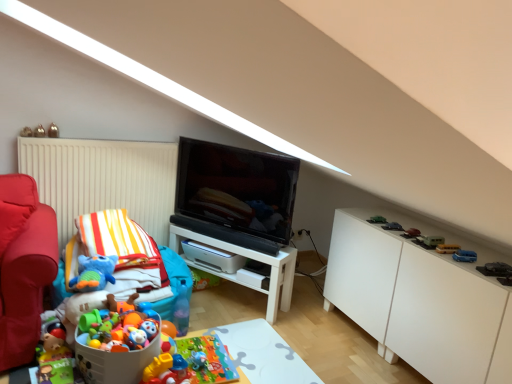
Question: Is metallic silver toy at upper left, placed as the 12th toy when sorted from bottom to top, not inside metallic gold toy at upper left, which is counted as the 1th toy, starting from the left?

Choices:
 (A) yes
 (B) no

Answer: (A)

Question: Is the depth of metallic silver toy at upper left, which is counted as the 1th toy, starting from the top, greater than that of metallic gold toy at upper left, which is counted as the 1th toy, starting from the left?

Choices:
 (A) yes
 (B) no

Answer: (A)

Question: From a real-world perspective, is metallic silver toy at upper left, placed as the second toy when sorted from left to right, on metallic gold toy at upper left, the 11th toy ordered from the bottom?

Choices:
 (A) yes
 (B) no

Answer: (A)

Question: Is metallic silver toy at upper left, which is counted as the 1th toy, starting from the top, touching metallic gold toy at upper left, which ranks as the second toy in top-to-bottom order?

Choices:
 (A) no
 (B) yes

Answer: (B)

Question: Are metallic silver toy at upper left, placed as the 12th toy when sorted from bottom to top, and metallic gold toy at upper left, which ranks as the second toy in top-to-bottom order, far apart?

Choices:
 (A) no
 (B) yes

Answer: (A)

Question: From the image's perspective, is plush toy at lower left, which appears as the tenth toy when viewed from the right, above or below yellow matte school bus at right, the third toy viewed from the right?

Choices:
 (A) above
 (B) below

Answer: (B)

Question: Is point (52, 319) positioned closer to the camera than point (458, 244)?

Choices:
 (A) closer
 (B) farther

Answer: (A)

Question: In the image, is plush toy at lower left, which appears as the tenth toy when viewed from the right, on the left side or the right side of yellow matte school bus at right, the 7th toy viewed from the top?

Choices:
 (A) left
 (B) right

Answer: (A)

Question: From a real-world perspective, is plush toy at lower left, which appears as the tenth toy when viewed from the right, positioned above or below yellow matte school bus at right, the 7th toy viewed from the top?

Choices:
 (A) below
 (B) above

Answer: (A)

Question: From a real-world perspective, is matte black tv at center positioned above or below green matte toy car at right, the 7th toy ordered from the bottom?

Choices:
 (A) below
 (B) above

Answer: (B)

Question: Relative to green matte toy car at right, which is the fourth toy from right to left, is matte black tv at center in front or behind?

Choices:
 (A) front
 (B) behind

Answer: (B)

Question: Based on their positions, is matte black tv at center located to the left or right of green matte toy car at right, the 7th toy ordered from the bottom?

Choices:
 (A) left
 (B) right

Answer: (A)

Question: From the image's perspective, is matte black tv at center located above or below green matte toy car at right, the 7th toy ordered from the bottom?

Choices:
 (A) below
 (B) above

Answer: (B)

Question: Considering the positions of green matte toy car at right, which is the fourth toy from right to left, and matte black tv at center in the image, is green matte toy car at right, which is the fourth toy from right to left, bigger or smaller than matte black tv at center?

Choices:
 (A) small
 (B) big

Answer: (A)

Question: Looking at their shapes, would you say green matte toy car at right, which is the 6th toy from top to bottom, is wider or thinner than matte black tv at center?

Choices:
 (A) wide
 (B) thin

Answer: (A)